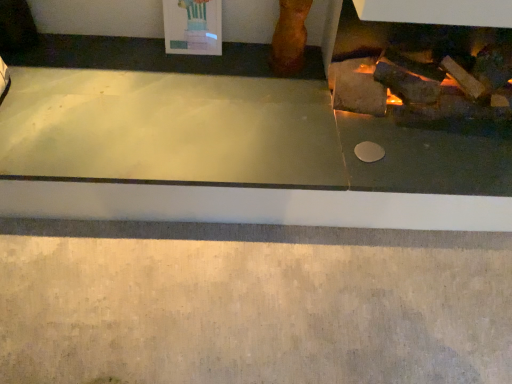
Question: Is matte stone fireplace at right completely or partially inside smooth concrete at lower center?

Choices:
 (A) yes
 (B) no

Answer: (B)

Question: From the image's perspective, is smooth concrete at lower center located above matte stone fireplace at right?

Choices:
 (A) yes
 (B) no

Answer: (B)

Question: Is smooth concrete at lower center to the right of matte stone fireplace at right from the viewer's perspective?

Choices:
 (A) no
 (B) yes

Answer: (B)

Question: Are smooth concrete at lower center and matte stone fireplace at right located far from each other?

Choices:
 (A) yes
 (B) no

Answer: (B)

Question: Is smooth concrete at lower center positioned with its back to matte stone fireplace at right?

Choices:
 (A) no
 (B) yes

Answer: (A)

Question: Considering the relative sizes of smooth concrete at lower center and matte stone fireplace at right in the image provided, is smooth concrete at lower center smaller than matte stone fireplace at right?

Choices:
 (A) yes
 (B) no

Answer: (A)

Question: From a real-world perspective, is matte stone fireplace at right located higher than smooth concrete at lower center?

Choices:
 (A) yes
 (B) no

Answer: (A)

Question: Is matte stone fireplace at right oriented away from smooth concrete at lower center?

Choices:
 (A) yes
 (B) no

Answer: (B)

Question: Can you confirm if matte stone fireplace at right is taller than smooth concrete at lower center?

Choices:
 (A) yes
 (B) no

Answer: (B)

Question: Are matte stone fireplace at right and smooth concrete at lower center beside each other?

Choices:
 (A) no
 (B) yes

Answer: (A)

Question: Can you confirm if matte stone fireplace at right is positioned to the left of smooth concrete at lower center?

Choices:
 (A) yes
 (B) no

Answer: (A)

Question: Considering the relative sizes of matte stone fireplace at right and smooth concrete at lower center in the image provided, is matte stone fireplace at right shorter than smooth concrete at lower center?

Choices:
 (A) yes
 (B) no

Answer: (A)

Question: In terms of height, does smooth concrete at lower center look taller or shorter compared to matte stone fireplace at right?

Choices:
 (A) short
 (B) tall

Answer: (B)